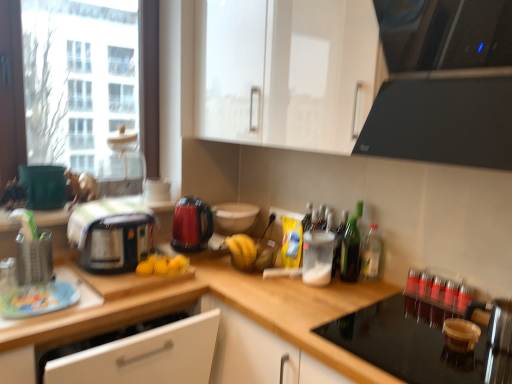
The height and width of the screenshot is (384, 512). I want to click on vacant space underneath black glass cooktop at upper right (from a real-world perspective), so click(409, 324).